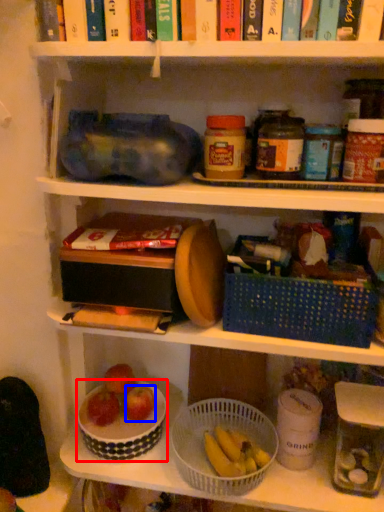
Question: Among these objects, which one is nearest to the camera, bowl (highlighted by a red box) or apple (highlighted by a blue box)?

Choices:
 (A) bowl
 (B) apple

Answer: (A)